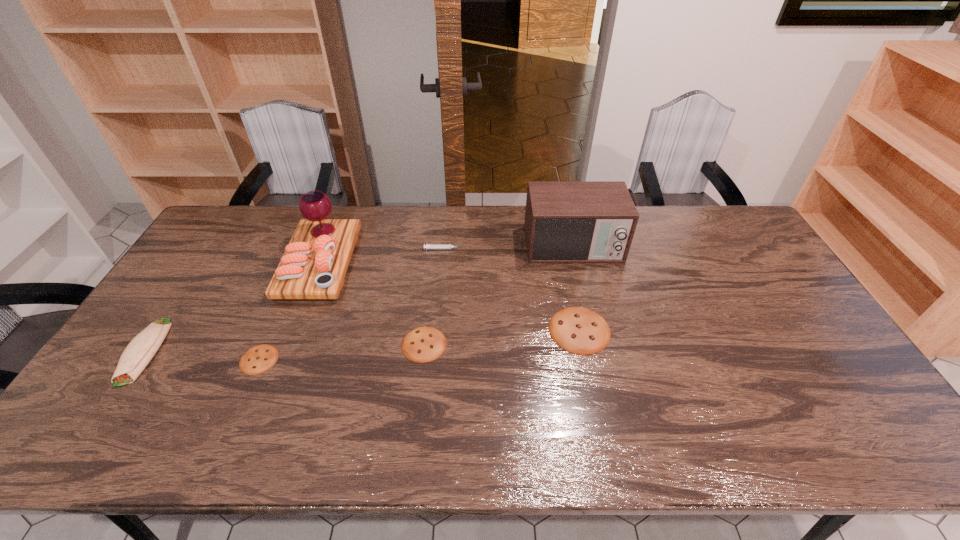
Please point a spot to add another cookie on the right. Please provide its 2D coordinates. Your answer should be formatted as a tuple, i.e. [(x, y)], where the tuple contains the x and y coordinates of a point satisfying the conditions above.

[(726, 316)]